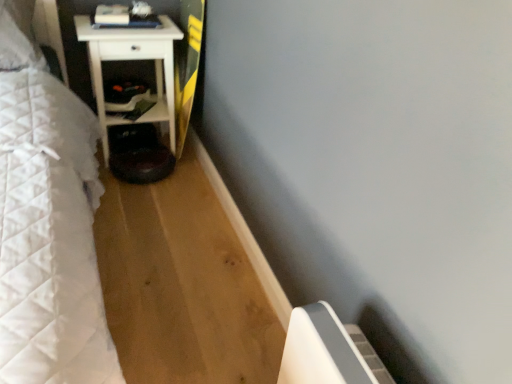
Measure the distance between point (161, 160) and camera.

Point (161, 160) and camera are 7.33 feet apart.

Find the location of a particular element. matte black shelf at lower left is located at coordinates (163, 93).

The height and width of the screenshot is (384, 512). Find the location of `shiny black step stool at lower center`. shiny black step stool at lower center is located at coordinates (138, 154).

Does point (127, 159) come closer to viewer compared to point (162, 38)?

That is False.

Based on the photo, is shiny black step stool at lower center aimed at white matte nightstand at left?

No.

From the image's perspective, is shiny black step stool at lower center positioned above or below white matte nightstand at left?

Clearly, from the image's perspective, shiny black step stool at lower center is below white matte nightstand at left.

Locate an element on the screen. furniture that appears above the shiny black step stool at lower center (from the image's perspective) is located at coordinates (131, 60).

Identify the location of shelf beneath the yellow-green wood longboard at center (from a real-world perspective). Image resolution: width=512 pixels, height=384 pixels. (163, 93).

Which is more to the left, yellow-green wood longboard at center or matte black shelf at lower left?

From the viewer's perspective, matte black shelf at lower left appears more on the left side.

From the image's perspective, is yellow-green wood longboard at center located above matte black shelf at lower left?

Yes, from the image's perspective, yellow-green wood longboard at center is over matte black shelf at lower left.

From the image's perspective, is shiny black step stool at lower center above matte black shelf at lower left?

No, from the image's perspective, shiny black step stool at lower center is not above matte black shelf at lower left.

Choose the correct answer: Is shiny black step stool at lower center inside matte black shelf at lower left or outside it?

Answer: shiny black step stool at lower center is located beyond the bounds of matte black shelf at lower left.

Which is in front, shiny black step stool at lower center or matte black shelf at lower left?

shiny black step stool at lower center.

Considering the relative sizes of shiny black step stool at lower center and matte black shelf at lower left in the image provided, is shiny black step stool at lower center bigger than matte black shelf at lower left?

Yes.

Which object is thinner, yellow-green wood longboard at center or white matte nightstand at left?

Thinner between the two is yellow-green wood longboard at center.

Is yellow-green wood longboard at center located outside white matte nightstand at left?

Absolutely, yellow-green wood longboard at center is external to white matte nightstand at left.

Considering the relative sizes of yellow-green wood longboard at center and white matte nightstand at left in the image provided, is yellow-green wood longboard at center shorter than white matte nightstand at left?

Incorrect, the height of yellow-green wood longboard at center does not fall short of that of white matte nightstand at left.

Is yellow-green wood longboard at center positioned far away from white matte nightstand at left?

Actually, yellow-green wood longboard at center and white matte nightstand at left are a little close together.

Are white matte nightstand at left and shiny black step stool at lower center making contact?

white matte nightstand at left and shiny black step stool at lower center are not in contact.

Looking at this image, can you tell me how much white matte nightstand at left and shiny black step stool at lower center differ in facing direction?

white matte nightstand at left and shiny black step stool at lower center are facing 0.405 degrees away from each other.

From their relative heights in the image, would you say white matte nightstand at left is taller or shorter than shiny black step stool at lower center?

Clearly, white matte nightstand at left is taller compared to shiny black step stool at lower center.

Who is more distant, white matte nightstand at left or shiny black step stool at lower center?

shiny black step stool at lower center is further away from the camera.

Does matte black shelf at lower left have a smaller size compared to yellow-green wood longboard at center?

Indeed, matte black shelf at lower left has a smaller size compared to yellow-green wood longboard at center.

Based on the photo, considering the sizes of objects matte black shelf at lower left and yellow-green wood longboard at center in the image provided, who is taller, matte black shelf at lower left or yellow-green wood longboard at center?

With more height is yellow-green wood longboard at center.

Looking at this image, who is more distant, matte black shelf at lower left or yellow-green wood longboard at center?

matte black shelf at lower left is further away from the camera.

Where is `shelf lying on the left of yellow-green wood longboard at center`? shelf lying on the left of yellow-green wood longboard at center is located at coordinates (163, 93).

Considering the relative sizes of white matte nightstand at left and yellow-green wood longboard at center in the image provided, is white matte nightstand at left taller than yellow-green wood longboard at center?

No.

Looking at this image, considering the positions of objects white matte nightstand at left and yellow-green wood longboard at center in the image provided, who is in front, white matte nightstand at left or yellow-green wood longboard at center?

yellow-green wood longboard at center is in front.

From the image's perspective, is white matte nightstand at left located above yellow-green wood longboard at center?

No.

Identify the location of longboard that appears above the white matte nightstand at left (from a real-world perspective). Image resolution: width=512 pixels, height=384 pixels. (187, 65).

Find the location of a particular element. The image size is (512, 384). furniture above the shiny black step stool at lower center (from the image's perspective) is located at coordinates [x=131, y=60].

At what (x,y) coordinates should I click in order to perform the action: click on longboard above the matte black shelf at lower left (from a real-world perspective). Please return your answer as a coordinate pair (x, y). This screenshot has height=384, width=512. Looking at the image, I should click on (187, 65).

Which object lies further to the anchor point shiny black step stool at lower center, white matte nightstand at left or matte black shelf at lower left?

Among the two, white matte nightstand at left is located further to shiny black step stool at lower center.

Based on their spatial positions, is matte black shelf at lower left or yellow-green wood longboard at center further from shiny black step stool at lower center?

The object further to shiny black step stool at lower center is yellow-green wood longboard at center.

Considering their positions, is shiny black step stool at lower center positioned further to yellow-green wood longboard at center than white matte nightstand at left?

shiny black step stool at lower center is further to yellow-green wood longboard at center.

Which object lies further to the anchor point yellow-green wood longboard at center, white matte nightstand at left or matte black shelf at lower left?

Among the two, white matte nightstand at left is located further to yellow-green wood longboard at center.

From the picture: Based on their spatial positions, is yellow-green wood longboard at center or white matte nightstand at left further from matte black shelf at lower left?

Based on the image, yellow-green wood longboard at center appears to be further to matte black shelf at lower left.

When comparing their distances from white matte nightstand at left, does matte black shelf at lower left or yellow-green wood longboard at center seem further?

yellow-green wood longboard at center is further to white matte nightstand at left.

Estimate the real-world distances between objects in this image. Which object is further from yellow-green wood longboard at center, white matte nightstand at left or shiny black step stool at lower center?

shiny black step stool at lower center lies further to yellow-green wood longboard at center than the other object.

Considering their positions, is shiny black step stool at lower center positioned further to matte black shelf at lower left than yellow-green wood longboard at center?

shiny black step stool at lower center lies further to matte black shelf at lower left than the other object.

Locate an element on the screen. This screenshot has width=512, height=384. shelf between white matte nightstand at left and shiny black step stool at lower center in the vertical direction is located at coordinates (163, 93).

This screenshot has width=512, height=384. Identify the location of furniture located between matte black shelf at lower left and yellow-green wood longboard at center in the left-right direction. (131, 60).

Identify the location of shelf between yellow-green wood longboard at center and shiny black step stool at lower center vertically. The width and height of the screenshot is (512, 384). tap(163, 93).

Locate an element on the screen. The image size is (512, 384). furniture that lies between yellow-green wood longboard at center and shiny black step stool at lower center from top to bottom is located at coordinates (131, 60).